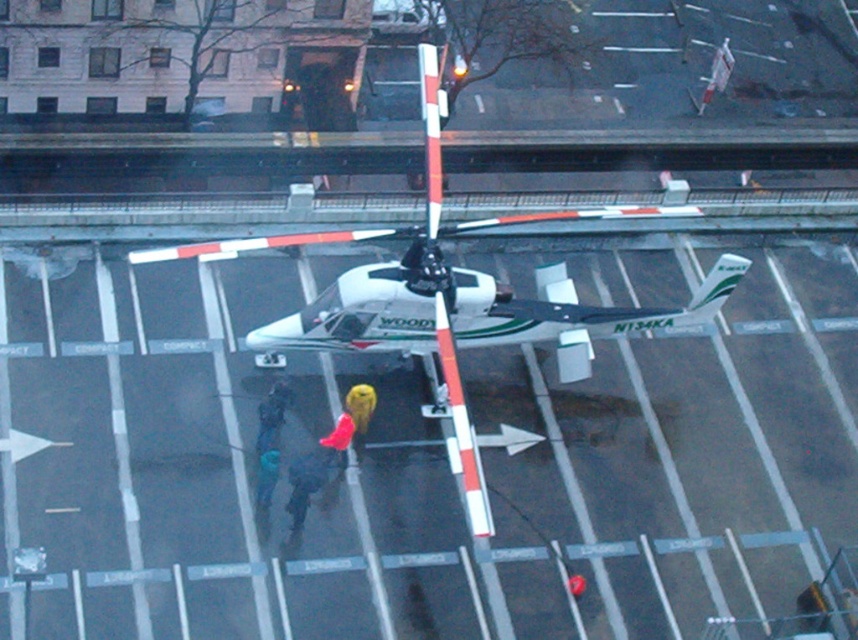
You are a pilot trying to park your helicopter on the helipad. You see the white glossy tarmac at center and the white matte helicopter at center. Which object should you align your helicopter with to park correctly?

You should align your helicopter with the white glossy tarmac at center because it is the designated parking area, as indicated by the white lines and arrows on the helipad, and the white matte helicopter at center is already parked there.